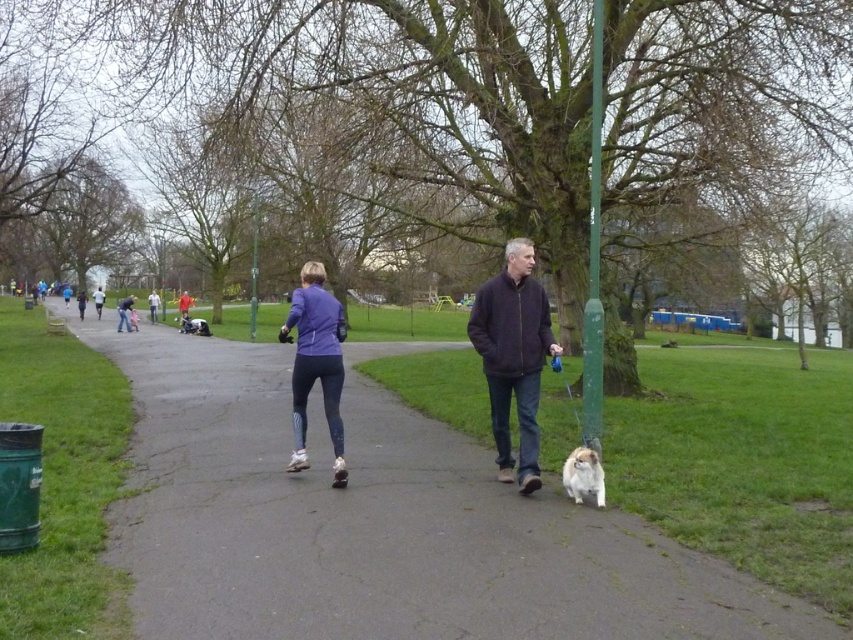
Question: Does green matte pole at right have a greater width compared to fluffy white dog at lower center?

Choices:
 (A) yes
 (B) no

Answer: (B)

Question: Does matte purple jacket at center appear over fluffy white dog at lower center?

Choices:
 (A) yes
 (B) no

Answer: (A)

Question: Considering the real-world distances, which object is closest to the fluffy white dog at lower center?

Choices:
 (A) dark brown fleece at center
 (B) matte purple jacket at center
 (C) smooth asphalt path at center
 (D) green matte pole at right

Answer: (A)

Question: Which of the following is the closest to the observer?

Choices:
 (A) smooth asphalt path at center
 (B) fluffy white dog at lower center
 (C) dark brown fleece at center

Answer: (A)

Question: Which point is closer to the camera taking this photo?

Choices:
 (A) (509, 280)
 (B) (576, 458)

Answer: (B)

Question: Does smooth asphalt path at center appear under fluffy white dog at lower center?

Choices:
 (A) no
 (B) yes

Answer: (B)